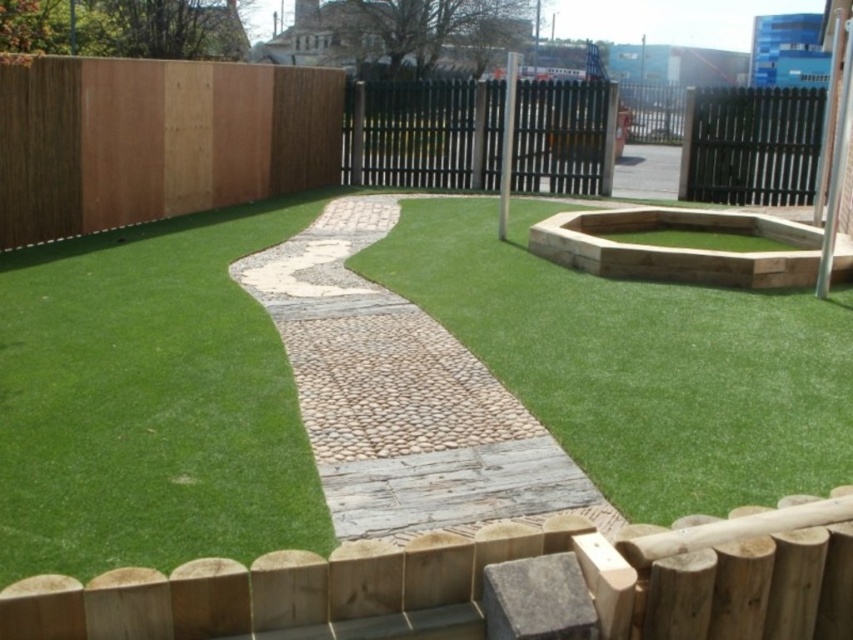
You are a gardener planning to install a new flower bed between the black metal fence at center and the black metal fence at upper right. Based on their positions, which fence should you start near to ensure the flower bed is placed correctly?

The black metal fence at upper right is behind the black metal fence at center, so you should start near the black metal fence at center to ensure the flower bed is placed in front of the upper right one.

You are standing at the center of the image and want to find the green artificial turf at left. In which direction should you look to locate it?

The green artificial turf at left is located at point (x=149, y=401), so you should look to the left side of the image to find it.

You are planning to place a large garden statue in the outdoor space shown. The statue requires a base that is wider than the green artificial turf at center. Will the black metal fence at upper right provide enough space for the statue? Explain your reasoning.

The green artificial turf at center has a lesser width compared to the black metal fence at upper right. Since the statue needs a base wider than the green artificial turf at center, the black metal fence at upper right, which is wider, can accommodate the statue.